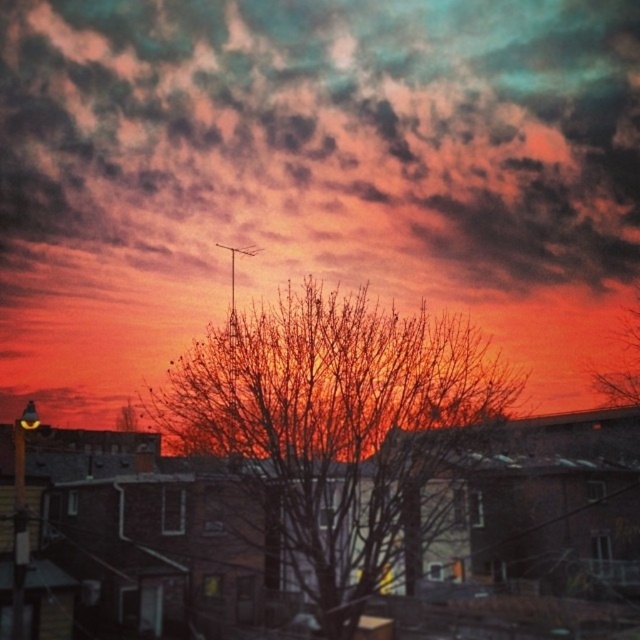
Question: Does cloudy sky at upper center have a smaller size compared to bare branches at center?

Choices:
 (A) yes
 (B) no

Answer: (B)

Question: Which of the following is the farthest from the observer?

Choices:
 (A) cloudy sky at upper center
 (B) bare branches at center

Answer: (A)

Question: Does cloudy sky at upper center appear on the left side of bare branches at center?

Choices:
 (A) no
 (B) yes

Answer: (A)

Question: Which object appears farthest from the camera in this image?

Choices:
 (A) bare branches at center
 (B) cloudy sky at upper center

Answer: (B)

Question: Observing the image, what is the correct spatial positioning of cloudy sky at upper center in reference to bare branches at center?

Choices:
 (A) left
 (B) right

Answer: (B)

Question: Among these points, which one is nearest to the camera?

Choices:
 (A) (300, 294)
 (B) (147, 230)

Answer: (A)